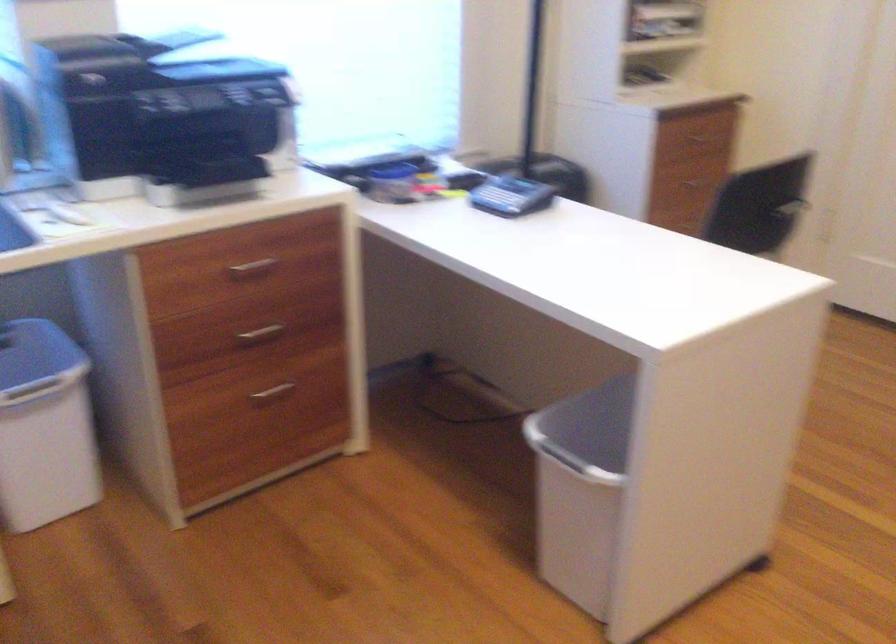
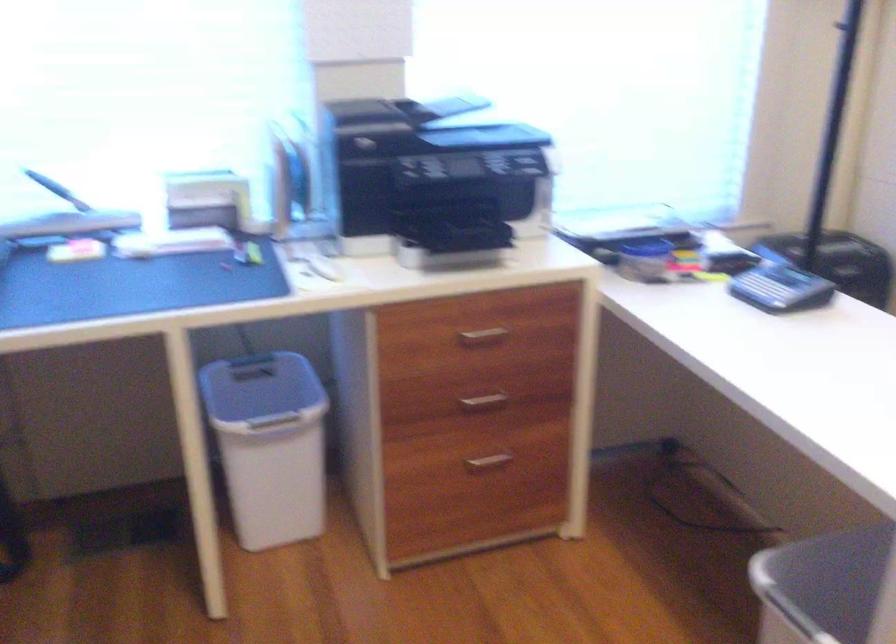
The point at (x=500, y=196) is marked in the first image. Where is the corresponding point in the second image?

(763, 289)